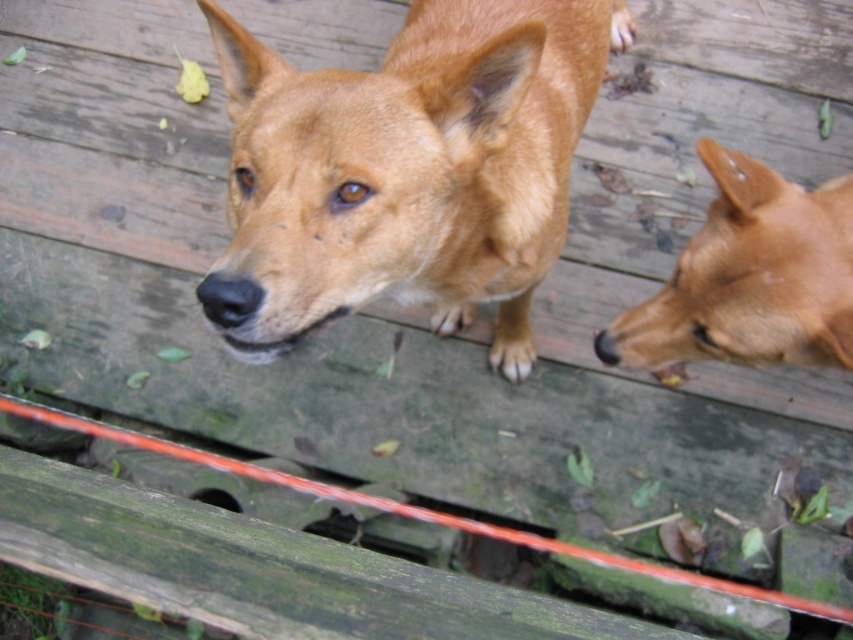
In the scene shown: Who is more distant from viewer, (x=219, y=317) or (x=704, y=339)?

The point (x=704, y=339) is more distant.

Does brown furry dog at upper center have a greater height compared to brown furry dog at right?

Correct, brown furry dog at upper center is much taller as brown furry dog at right.

Is point (225, 45) positioned before point (810, 228)?

Yes, point (225, 45) is in front of point (810, 228).

The width and height of the screenshot is (853, 640). Identify the location of brown furry dog at upper center. (405, 170).